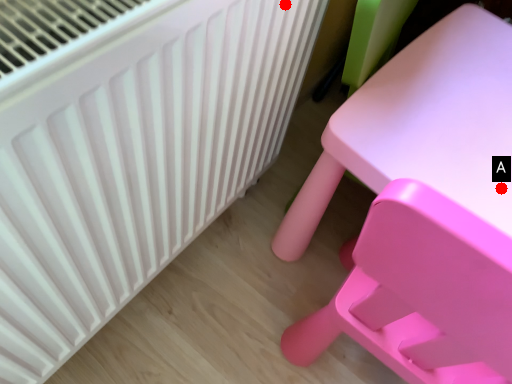
Question: Two points are circled on the image, labeled by A and B beside each circle. Among these points, which one is nearest to the camera?

Choices:
 (A) A is closer
 (B) B is closer

Answer: (B)